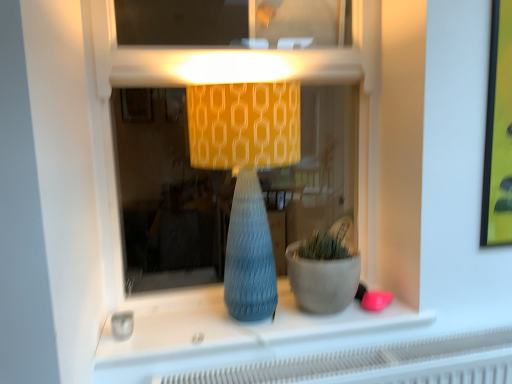
Question: Should I look upward or downward to see matte gray vase at center?

Choices:
 (A) down
 (B) up

Answer: (A)

Question: Does matte concrete flowerpot at center have a lesser width compared to matte yellow fabric lampshade at center?

Choices:
 (A) no
 (B) yes

Answer: (B)

Question: Can matte yellow fabric lampshade at center be found inside matte concrete flowerpot at center?

Choices:
 (A) yes
 (B) no

Answer: (B)

Question: Considering the relative sizes of matte concrete flowerpot at center and matte yellow fabric lampshade at center in the image provided, is matte concrete flowerpot at center wider than matte yellow fabric lampshade at center?

Choices:
 (A) yes
 (B) no

Answer: (B)

Question: Considering the relative sizes of matte concrete flowerpot at center and matte yellow fabric lampshade at center in the image provided, is matte concrete flowerpot at center shorter than matte yellow fabric lampshade at center?

Choices:
 (A) yes
 (B) no

Answer: (A)

Question: Does matte concrete flowerpot at center come in front of matte yellow fabric lampshade at center?

Choices:
 (A) no
 (B) yes

Answer: (A)

Question: From the image's perspective, is matte concrete flowerpot at center over matte yellow fabric lampshade at center?

Choices:
 (A) no
 (B) yes

Answer: (A)

Question: Can you confirm if matte concrete flowerpot at center is positioned to the right of matte gray vase at center?

Choices:
 (A) no
 (B) yes

Answer: (B)

Question: From the image's perspective, is matte concrete flowerpot at center beneath matte gray vase at center?

Choices:
 (A) no
 (B) yes

Answer: (A)

Question: Are matte concrete flowerpot at center and matte gray vase at center far apart?

Choices:
 (A) no
 (B) yes

Answer: (A)

Question: Is matte concrete flowerpot at center to the left of matte gray vase at center from the viewer's perspective?

Choices:
 (A) no
 (B) yes

Answer: (A)

Question: Does matte concrete flowerpot at center have a smaller size compared to matte gray vase at center?

Choices:
 (A) yes
 (B) no

Answer: (B)

Question: From the image's perspective, is matte concrete flowerpot at center located above matte gray vase at center?

Choices:
 (A) yes
 (B) no

Answer: (A)

Question: Is matte gray vase at center outside of matte blue vase at center?

Choices:
 (A) yes
 (B) no

Answer: (A)